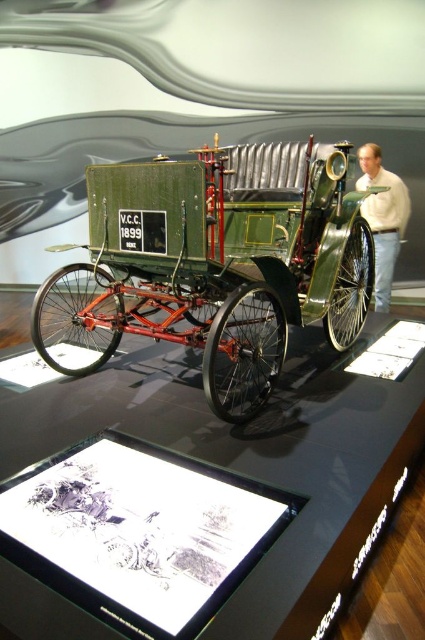
Is point (119, 296) less distant than point (376, 220)?

Yes.

Who is positioned more to the left, green matte wagon at center or light beige sweater at right?

green matte wagon at center is more to the left.

Who is more distant from viewer, [110,180] or [399,218]?

Point [399,218]

Identify the location of green matte wagon at center. (220, 262).